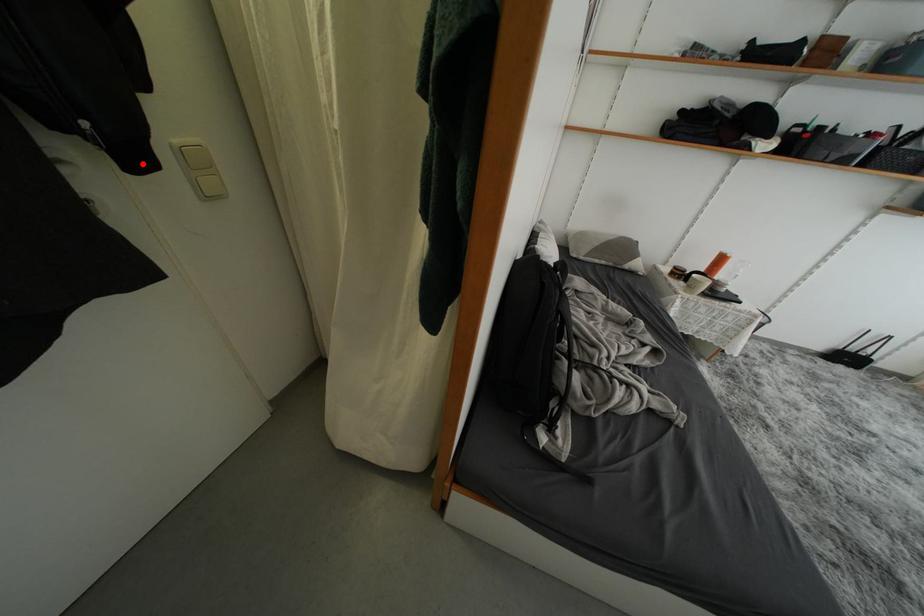
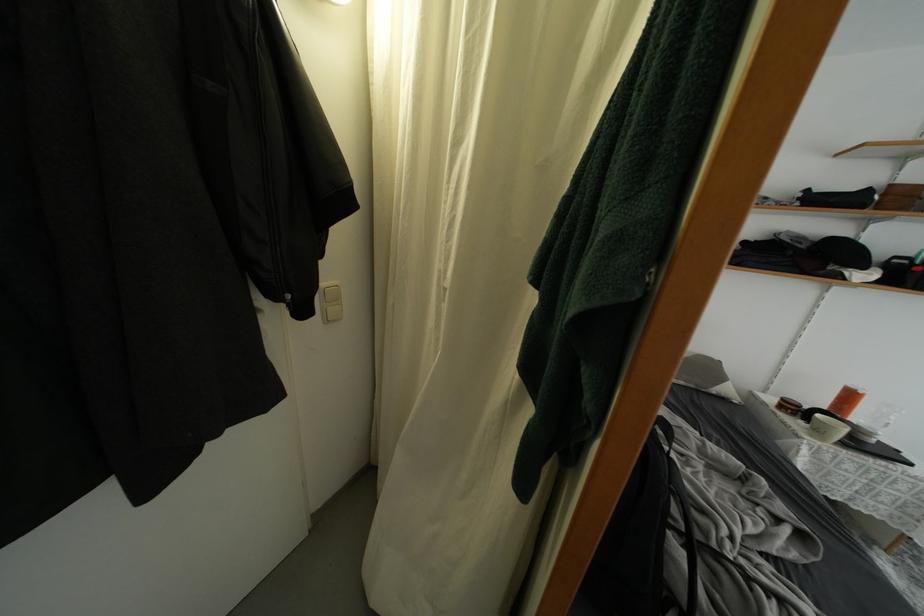
In the second image, find the point that corresponds to the highlighted location in the first image.

(310, 315)